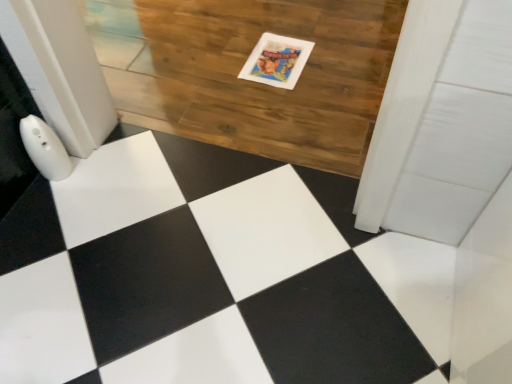
Identify the location of free region under matte paper postcard at upper center (from a real-world perspective). Image resolution: width=512 pixels, height=384 pixels. (278, 59).